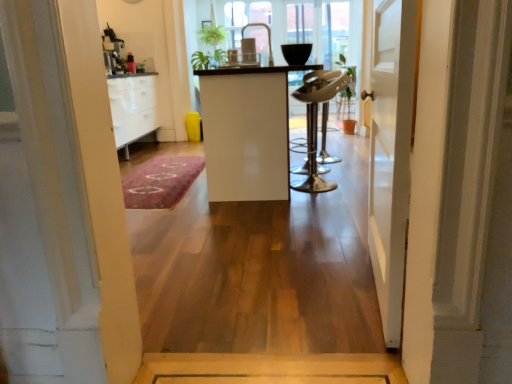
The width and height of the screenshot is (512, 384). What are the coordinates of `vacant space in between shiny metallic bar stool at center and white wooden door at center` in the screenshot? It's located at (333, 214).